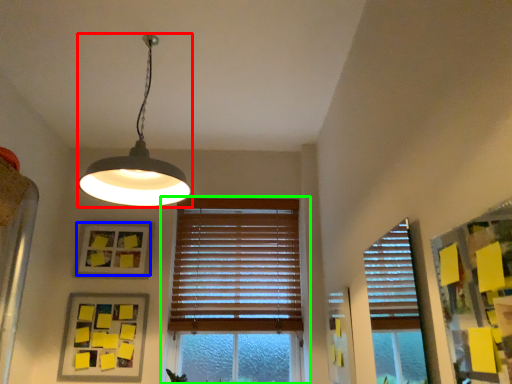
Question: Considering the real-world distances, which object is farthest from lamp (highlighted by a red box)? picture frame (highlighted by a blue box) or window (highlighted by a green box)?

Choices:
 (A) picture frame
 (B) window

Answer: (B)